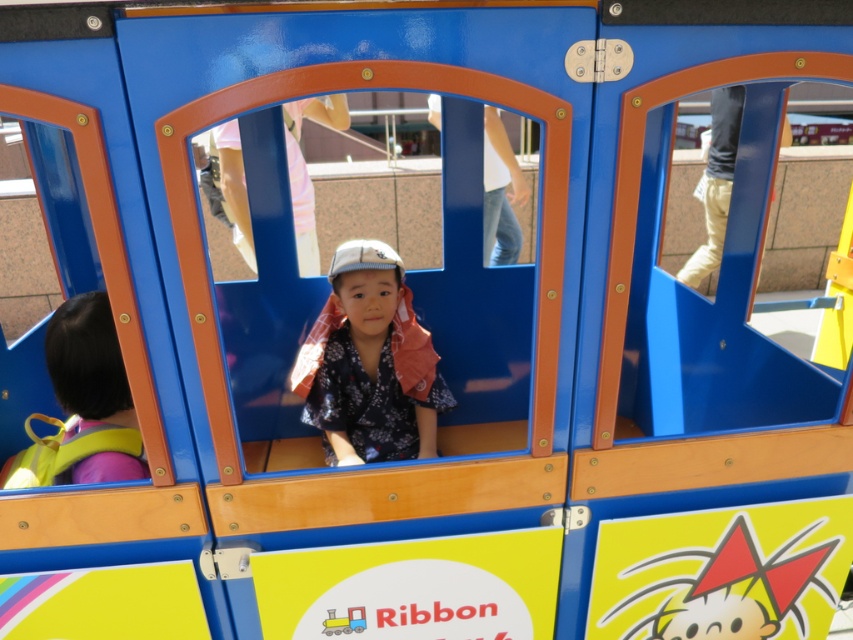
You are a photographer trying to capture a photo of the child in the train car. You notice the floral fabric kimono at center and the yellow fabric backpack at left. Which object should you focus on to ensure it takes up more space in the photo?

The floral fabric kimono at center should be focused on because it has a larger size compared to the yellow fabric backpack at left, so it will take up more space in the photo.

You are a photographer trying to capture the child in the train car. You notice the floral fabric kimono at center and the yellow fabric backpack at left. Which item is located to the right of the other?

The floral fabric kimono at center is positioned on the right side of the yellow fabric backpack at left.

Looking at this image, you are a photographer trying to capture the child in the train car. The train car is blue with orange trim. You notice a point at coordinates (370, 364). What object is located at that point?

The point at coordinates (370, 364) marks the floral fabric kimono at center.